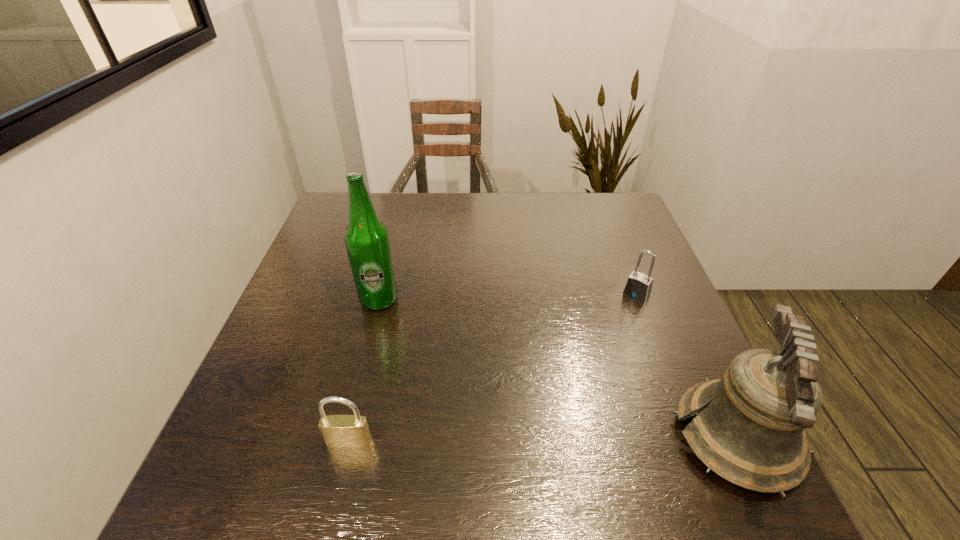
Where is `free spot at the far left corner of the desktop`? The height and width of the screenshot is (540, 960). free spot at the far left corner of the desktop is located at coordinates (377, 205).

In the image, there is a desktop. Identify the location of free space at the far right corner. This screenshot has width=960, height=540. (588, 217).

The image size is (960, 540). In the image, there is a desktop. Find the location of `vacant space at the near right corner`. vacant space at the near right corner is located at coordinates (680, 437).

Locate an element on the screen. free point between the third shortest object and the farther padlock is located at coordinates (686, 366).

You are a GUI agent. You are given a task and a screenshot of the screen. Output one action in this format:
    pyautogui.click(x=<x>, y=<y>)
    Task: Click on the free spot between the tallest object and the bell
    Image resolution: width=960 pixels, height=540 pixels.
    Given the screenshot: What is the action you would take?
    pyautogui.click(x=558, y=369)

At what (x,y) coordinates should I click in order to perform the action: click on empty space that is in between the tallest object and the farther padlock. Please return your answer as a coordinate pair (x, y). The width and height of the screenshot is (960, 540). Looking at the image, I should click on (508, 297).

Where is `vacant area that lies between the tallest object and the right padlock`? Image resolution: width=960 pixels, height=540 pixels. vacant area that lies between the tallest object and the right padlock is located at coordinates (508, 297).

Where is `free space between the third shortest object and the nearer padlock`? This screenshot has height=540, width=960. free space between the third shortest object and the nearer padlock is located at coordinates (542, 440).

Locate an element on the screen. This screenshot has height=540, width=960. free space between the farther padlock and the bell is located at coordinates pos(686,366).

At what (x,y) coordinates should I click in order to perform the action: click on free space between the beer bottle and the third shortest object. Please return your answer as a coordinate pair (x, y). Image resolution: width=960 pixels, height=540 pixels. Looking at the image, I should click on (558, 369).